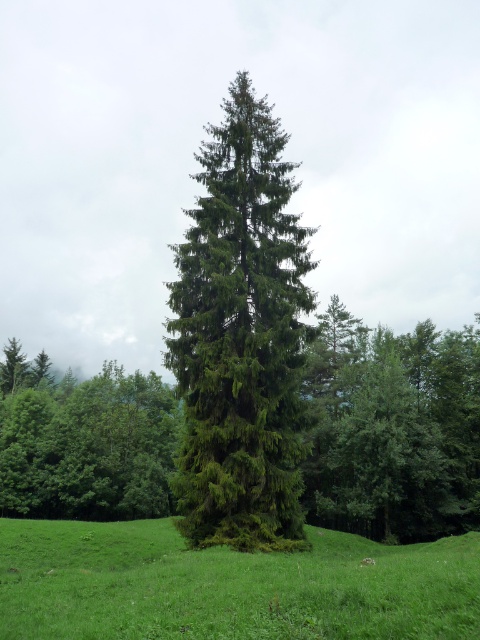
Which is more to the left, green textured tree at center or green matte tree at center?

Positioned to the left is green matte tree at center.

Does green textured tree at center come behind green matte tree at center?

No, it is not.

Image resolution: width=480 pixels, height=640 pixels. Describe the element at coordinates (240, 339) in the screenshot. I see `green textured tree at center` at that location.

The width and height of the screenshot is (480, 640). Find the location of `green textured tree at center`. green textured tree at center is located at coordinates (240, 339).

Who is more distant from viewer, (260, 371) or (300, 563)?

Positioned behind is point (260, 371).

Find the location of a particular element. green textured tree at center is located at coordinates (240, 339).

Does point (237, 278) come closer to viewer compared to point (122, 572)?

No, it is not.

The height and width of the screenshot is (640, 480). Find the location of `green textured tree at center`. green textured tree at center is located at coordinates (240, 339).

Who is more forward, (266, 595) or (22, 476)?

Point (266, 595)

Can you confirm if green grassy field at center is thinner than green matte tree at center?

Correct, green grassy field at center's width is less than green matte tree at center's.

Where is `green grassy field at center`? green grassy field at center is located at coordinates (228, 586).